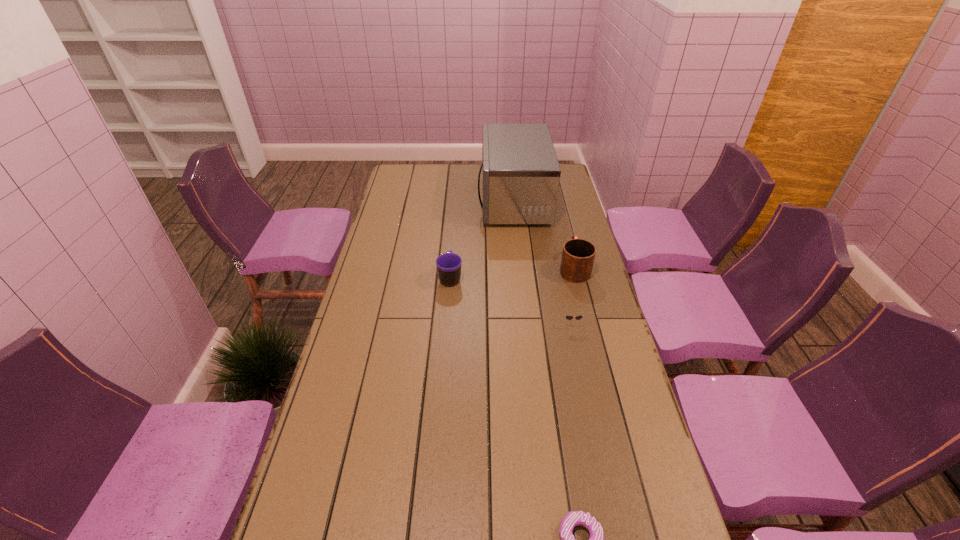
Locate an element on the screen. This screenshot has height=540, width=960. mug at the right edge is located at coordinates 578,255.

Find the location of `sunglasses that is at the right edge`. sunglasses that is at the right edge is located at coordinates (568, 317).

I want to click on object at the far right corner, so click(x=521, y=174).

This screenshot has width=960, height=540. In the image, there is a desktop. Identify the location of free space at the far edge. click(480, 184).

The height and width of the screenshot is (540, 960). What are the coordinates of `vacant space at the left edge of the desktop` in the screenshot? It's located at (307, 464).

At what (x,y) coordinates should I click in order to perform the action: click on free space at the right edge of the desktop. Please return your answer as a coordinate pair (x, y). Looking at the image, I should click on (610, 530).

The width and height of the screenshot is (960, 540). In order to click on free space at the far left corner of the desktop in this screenshot , I will do `click(409, 171)`.

What are the coordinates of `vacant space that is in between the tallest object and the sunglasses` in the screenshot? It's located at (542, 261).

Where is `free spot between the second nearest object and the right mug`? free spot between the second nearest object and the right mug is located at coordinates (572, 295).

Locate an element on the screen. The width and height of the screenshot is (960, 540). object that stands as the second closest to the fourth shortest object is located at coordinates (521, 174).